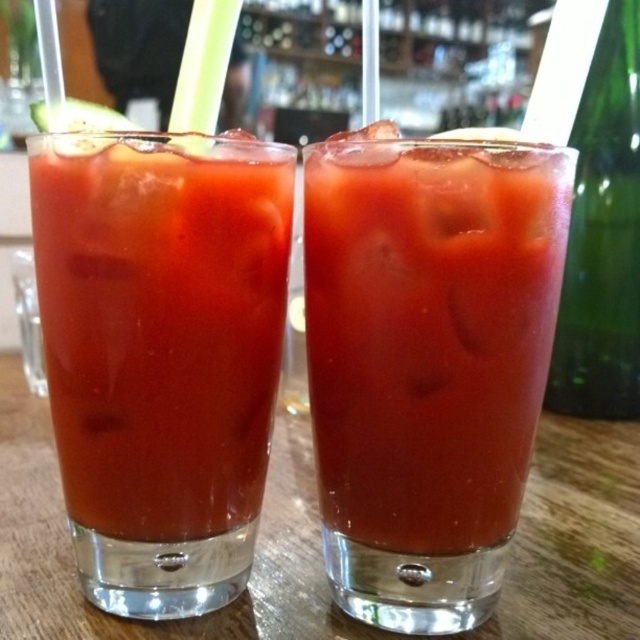
You are a bartender preparing drinks and need to pour a Bloody Mary into the taller glass. Which glass should you choose between the matte glass at center and the translucent glass at center?

The matte glass at center is taller than the translucent glass at center, so you should choose the matte glass at center to pour the Bloody Mary.

You are a bartender preparing drinks and need to reach for the matte glass at center. Considering your arm can extend 14 inches, will you be able to reach it without moving your body?

The matte glass at center is 14.51 inches away from the viewer. Since your arm can only extend 14 inches, you will not be able to reach it without moving your body.